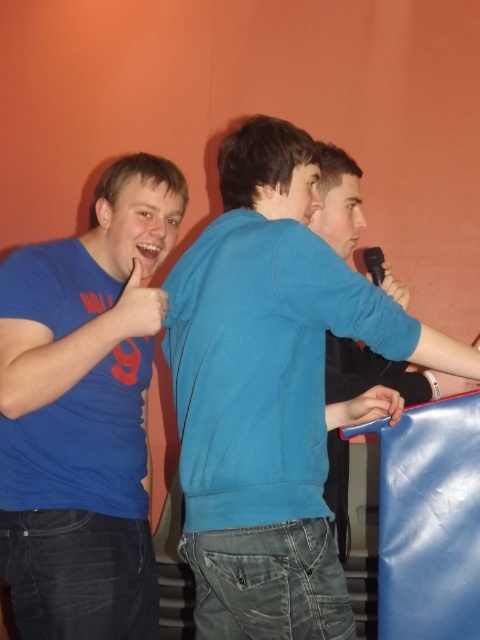
Question: Is blue matte t-shirt at left further to the viewer compared to matte blue hand at center?

Choices:
 (A) no
 (B) yes

Answer: (A)

Question: Is blue cotton sweater at center below matte blue hand at center?

Choices:
 (A) no
 (B) yes

Answer: (A)

Question: Among these points, which one is nearest to the camera?

Choices:
 (A) (4, 508)
 (B) (212, 632)

Answer: (B)

Question: Observing the image, what is the correct spatial positioning of matte blue hand at center in reference to matte black microphone at upper right?

Choices:
 (A) below
 (B) above

Answer: (A)

Question: Which object is the farthest from the blue matte t-shirt at left?

Choices:
 (A) blue cotton shirt at center
 (B) matte blue hand at left
 (C) matte black microphone at upper right
 (D) blue cotton sweater at center

Answer: (C)

Question: Among these objects, which one is nearest to the camera?

Choices:
 (A) matte black microphone at upper right
 (B) blue cotton shirt at center
 (C) blue matte t-shirt at left
 (D) matte blue hand at left

Answer: (C)